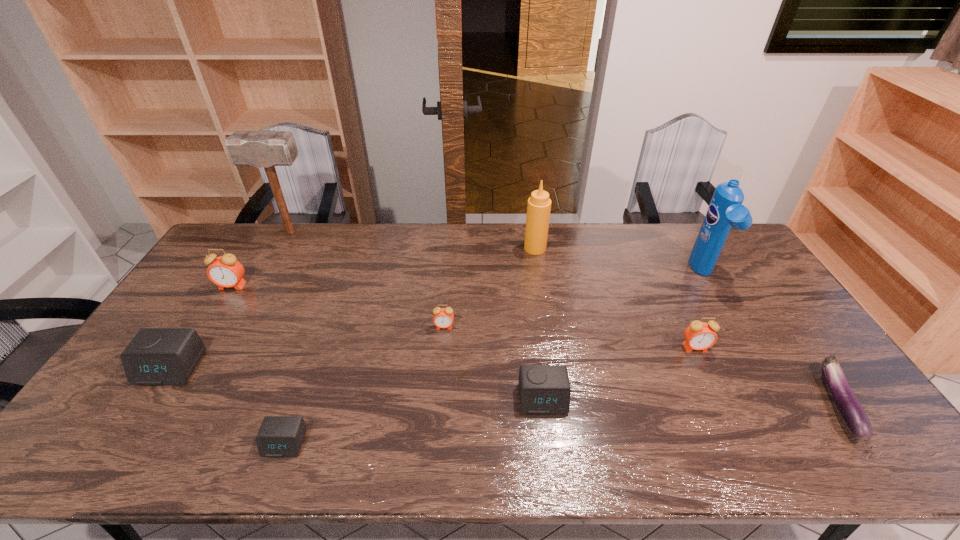
Identify the location of vacant space at the right edge of the desktop. (806, 367).

In the image, there is a desktop. Where is `vacant space at the far right corner`? vacant space at the far right corner is located at coordinates (732, 237).

Find the location of a particular element. The image size is (960, 540). free spot between the tan condiment and the leftmost pink alarm clock is located at coordinates click(x=384, y=267).

You are a GUI agent. You are given a task and a screenshot of the screen. Output one action in this format:
    pyautogui.click(x=<x>, y=<y>)
    Task: Click on the free space between the mallet and the tan condiment
    
    Given the screenshot: What is the action you would take?
    pyautogui.click(x=413, y=240)

At what (x,y) coordinates should I click in order to perform the action: click on vacant region between the second alarm clock from right to left and the farthest object. Please return your answer as a coordinate pair (x, y). The height and width of the screenshot is (540, 960). Looking at the image, I should click on (417, 315).

Where is `vacant space that's between the leftmost black alarm clock and the leftmost pink alarm clock`? This screenshot has height=540, width=960. vacant space that's between the leftmost black alarm clock and the leftmost pink alarm clock is located at coordinates (202, 327).

This screenshot has height=540, width=960. I want to click on blank region between the rightmost object and the shampoo, so click(x=771, y=339).

Locate an element on the screen. free space between the mallet and the third tallest object is located at coordinates (413, 240).

This screenshot has height=540, width=960. Identify the location of blank region between the biggest pink alarm clock and the rightmost black alarm clock. (388, 342).

Where is `vacant space that is in between the farthest object and the fifth alarm clock from left to right`? This screenshot has height=540, width=960. vacant space that is in between the farthest object and the fifth alarm clock from left to right is located at coordinates (417, 315).